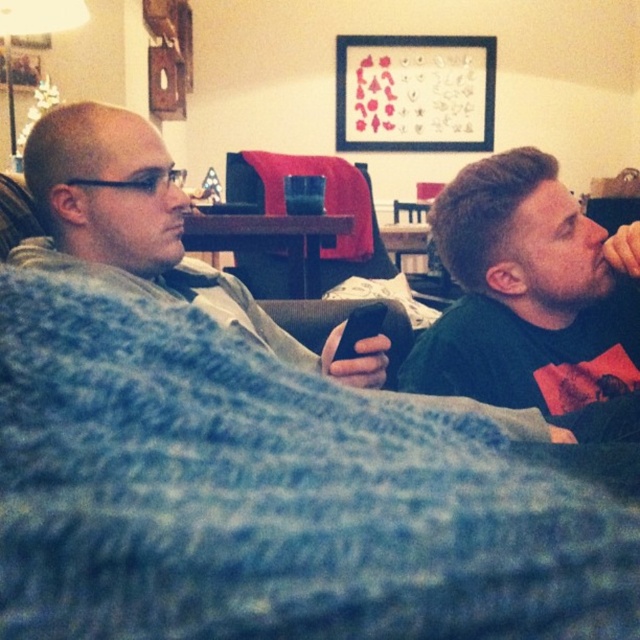
Question: Which object appears farthest from the camera in this image?

Choices:
 (A) blue knitted blanket at lower left
 (B) black plastic remote at center
 (C) matte gray sweater at left

Answer: (C)

Question: Which of the following is the closest to the observer?

Choices:
 (A) black plastic remote at center
 (B) green matte shirt at right
 (C) blue knitted blanket at lower left

Answer: (C)

Question: Which object is the farthest from the blue knitted blanket at lower left?

Choices:
 (A) black plastic remote at center
 (B) green matte shirt at right
 (C) matte gray sweater at left

Answer: (B)

Question: Is green matte shirt at right positioned in front of matte gray sweater at left?

Choices:
 (A) no
 (B) yes

Answer: (B)

Question: Can you confirm if green matte shirt at right is positioned below matte gray sweater at left?

Choices:
 (A) yes
 (B) no

Answer: (A)

Question: Can you confirm if green matte shirt at right is bigger than black plastic remote at center?

Choices:
 (A) yes
 (B) no

Answer: (A)